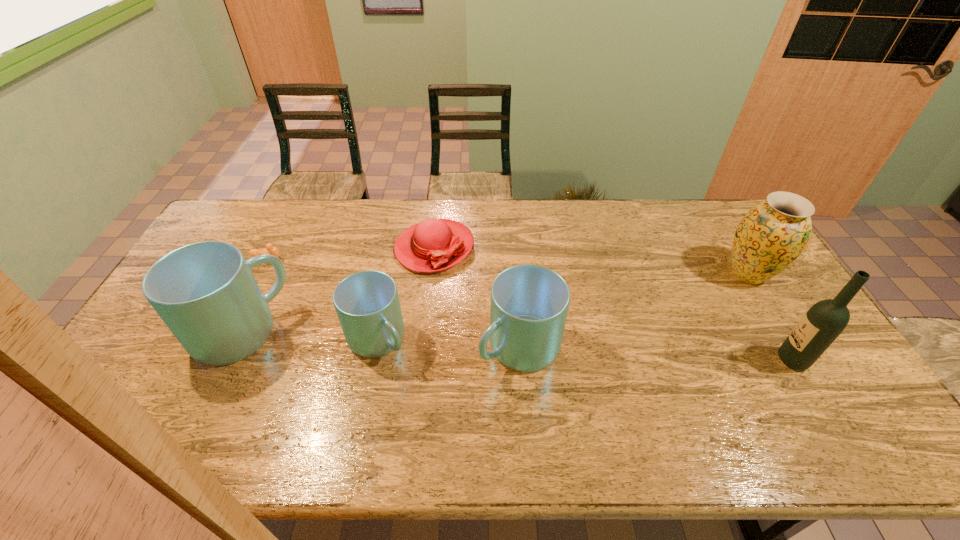
Where is `vase that is at the right edge`? vase that is at the right edge is located at coordinates (773, 233).

At what (x,y) coordinates should I click in order to perform the action: click on wine bottle located at the right edge. Please return your answer as a coordinate pair (x, y). Looking at the image, I should click on (820, 326).

In the image, there is a desktop. At what (x,y) coordinates should I click in order to perform the action: click on vacant space at the far edge. Please return your answer as a coordinate pair (x, y). The height and width of the screenshot is (540, 960). Looking at the image, I should click on (602, 212).

You are a GUI agent. You are given a task and a screenshot of the screen. Output one action in this format:
    pyautogui.click(x=<x>, y=<y>)
    Task: Click on the vacant region at the left edge
    This screenshot has width=960, height=540.
    Given the screenshot: What is the action you would take?
    pyautogui.click(x=142, y=381)

At what (x,y) coordinates should I click in order to perform the action: click on vacant space at the far left corner of the desktop. Please return your answer as a coordinate pair (x, y). The width and height of the screenshot is (960, 540). Looking at the image, I should click on (x=262, y=203).

Find the location of a particular element. Image resolution: width=960 pixels, height=540 pixels. free location at the far right corner is located at coordinates (732, 207).

What are the coordinates of `free space at the near right corner of the desktop` in the screenshot? It's located at (793, 383).

I want to click on blank region between the second tallest mug and the fifth tallest object, so click(x=448, y=343).

Identify the location of empty location between the fifth object from left to right and the hat. (477, 298).

You are a GUI agent. You are given a task and a screenshot of the screen. Output one action in this format:
    pyautogui.click(x=<x>, y=<y>)
    Task: Click on the vacant space that is in between the second shortest object and the third shortest object
    
    Given the screenshot: What is the action you would take?
    pyautogui.click(x=406, y=294)